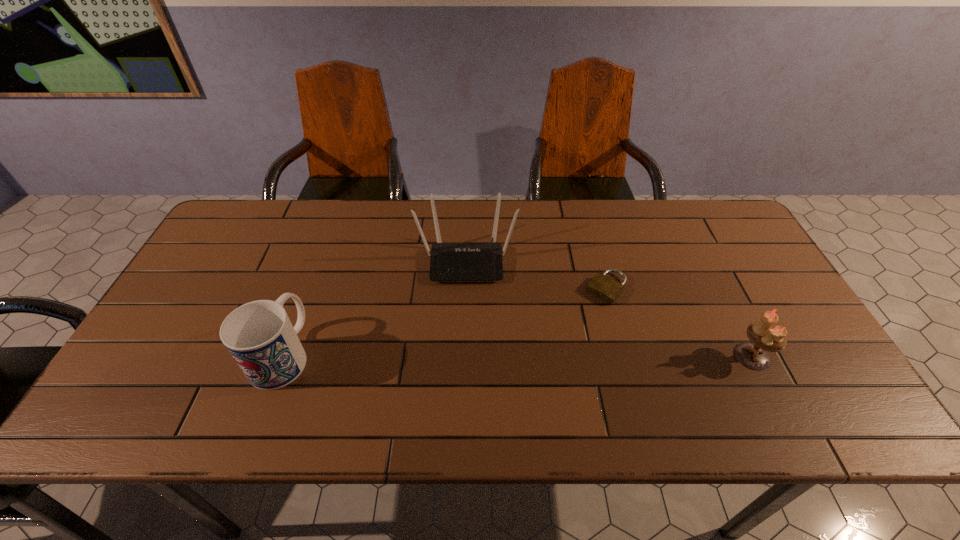
In order to click on vacant area that lies between the padlock and the second object from left to right in this screenshot , I will do `click(537, 274)`.

Where is `empty space between the padlock and the router`? This screenshot has height=540, width=960. empty space between the padlock and the router is located at coordinates (537, 274).

Select which object appears as the second closest to the mug. Please provide its 2D coordinates. Your answer should be formatted as a tuple, i.e. [(x, y)], where the tuple contains the x and y coordinates of a point satisfying the conditions above.

[(602, 286)]

Point out which object is positioned as the nearest to the padlock. Please provide its 2D coordinates. Your answer should be formatted as a tuple, i.e. [(x, y)], where the tuple contains the x and y coordinates of a point satisfying the conditions above.

[(481, 261)]

What are the coordinates of `free region that satisfies the following two spatial constraints: 1. on the front side of the rightmost object; 2. on the left side of the router` in the screenshot? It's located at (464, 356).

The height and width of the screenshot is (540, 960). I want to click on free space that satisfies the following two spatial constraints: 1. on the front side of the second object from left to right; 2. on the right side of the shortest object, so click(x=466, y=288).